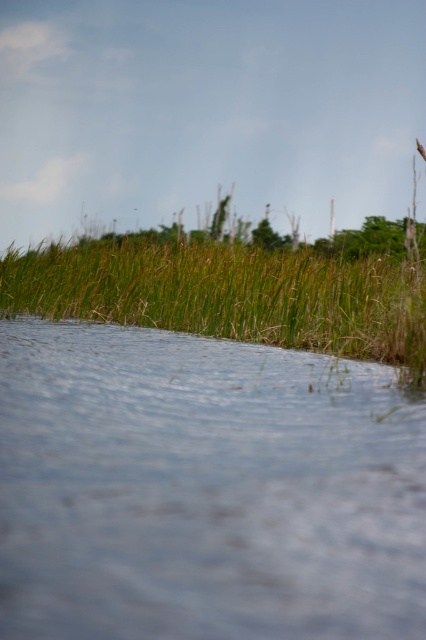
The height and width of the screenshot is (640, 426). Describe the element at coordinates (204, 490) in the screenshot. I see `clear water at lower center` at that location.

Does clear water at lower center appear over green grass at upper center?

No, clear water at lower center is not above green grass at upper center.

Between point (380, 372) and point (199, 252), which one is positioned behind?

The point (199, 252) is more distant.

The height and width of the screenshot is (640, 426). Identify the location of clear water at lower center. (204, 490).